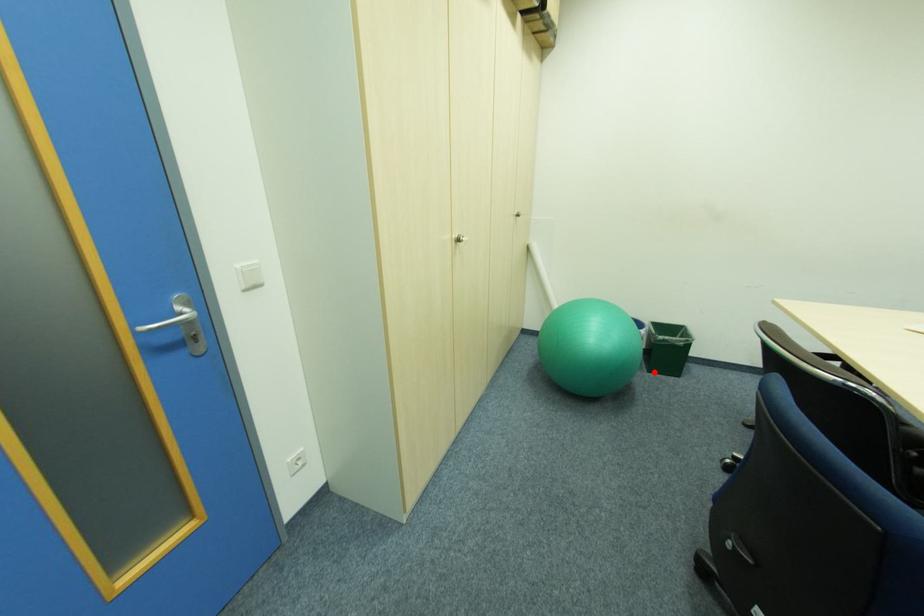
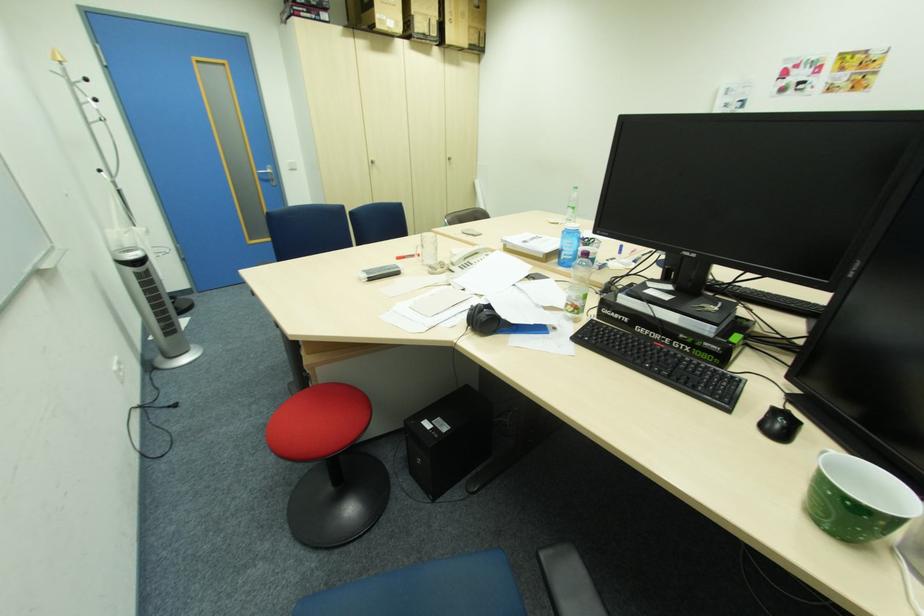
Question: I am providing you with two images of the same scene from different viewpoints. A red point is marked on the first image. Can you still see the location of the red point in image 2?

Choices:
 (A) Yes
 (B) No

Answer: (B)